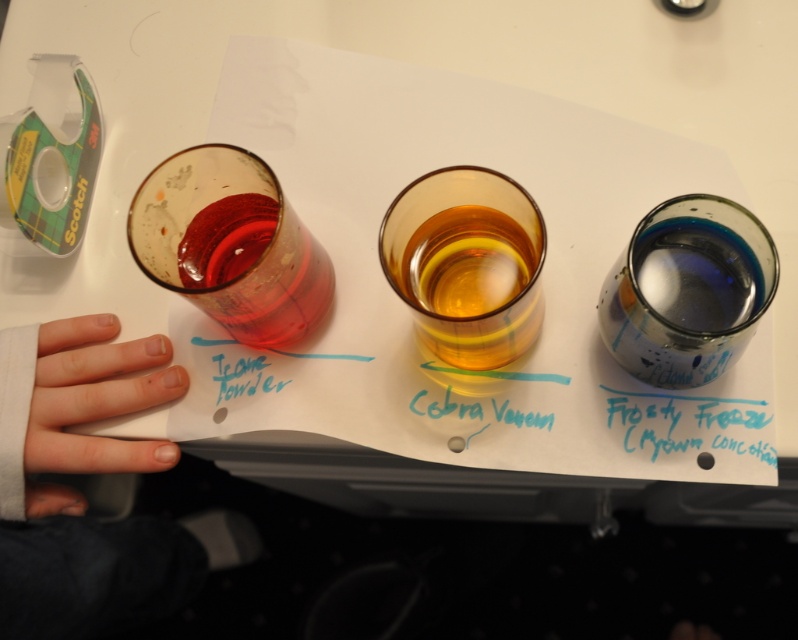
You are a bartender preparing a cocktail and need to pour the contents of the transparent plastic shot glass at left into the cobra venom at center. Can you do this without spilling, considering their heights?

The transparent plastic shot glass at left has a greater height compared to cobra venom at center. Since the shot glass is taller, pouring its contents into the shorter cobra venom at center might risk spilling if the receiving glass cannot accommodate the volume, but the question does not specify volume. However, based on height alone, the taller glass may have a larger capacity, so pouring could be possible if the center glass is stable and you pour carefully.

You are a bartender preparing a cocktail that requires precise measurements. You have a transparent plastic shot glass at left and cobra venom at center. Which of these can hold more liquid based on their widths?

The transparent plastic shot glass at left can hold more liquid because its width surpasses that of the cobra venom at center.

You are a scientist working in a lab and need to place a 2.5 inch wide test tube between the pale skin at lower left and the teal matte powder at upper left. Will there be enough space?

The pale skin at lower left and the teal matte powder at upper left are 2.53 inches apart from each other, so yes, the test tube can fit between them since the distance is slightly larger than the tube width.